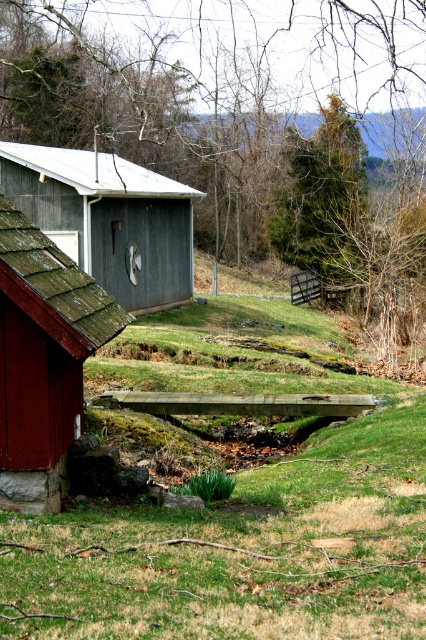
Question: Can you confirm if rustic wood hut at lower left is smaller than green mossy shed at upper left?

Choices:
 (A) no
 (B) yes

Answer: (B)

Question: Does rustic wood hut at lower left lie in front of green mossy shed at upper left?

Choices:
 (A) no
 (B) yes

Answer: (B)

Question: Among these points, which one is farthest from the camera?

Choices:
 (A) (169, 305)
 (B) (66, 438)

Answer: (A)

Question: Which point is closer to the camera?

Choices:
 (A) (11, 435)
 (B) (71, 212)

Answer: (A)

Question: Is rustic wood hut at lower left positioned behind green mossy shed at upper left?

Choices:
 (A) yes
 (B) no

Answer: (B)